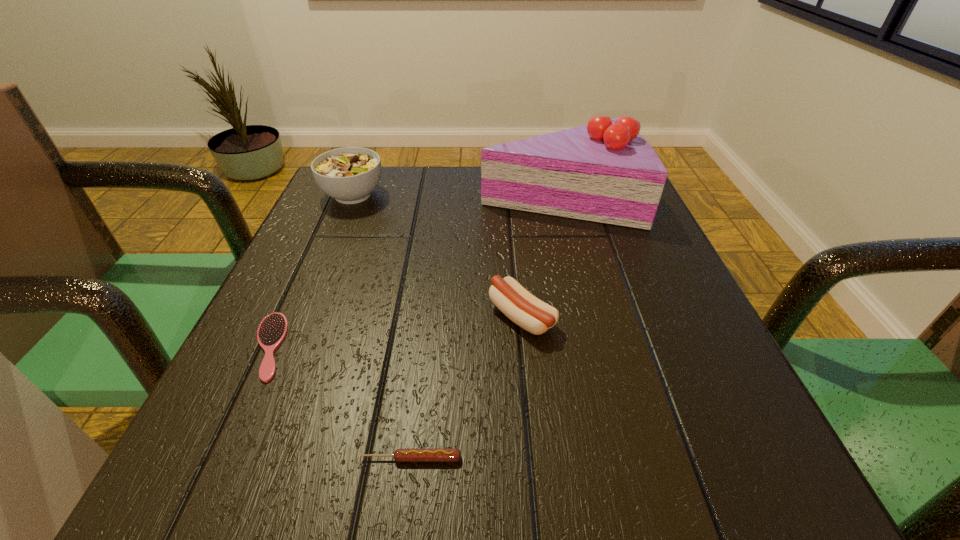
The height and width of the screenshot is (540, 960). Find the location of `free space that satisfies the following two spatial constraints: 1. on the back side of the tallest object; 2. on the left side of the right sausage`. free space that satisfies the following two spatial constraints: 1. on the back side of the tallest object; 2. on the left side of the right sausage is located at coordinates (510, 198).